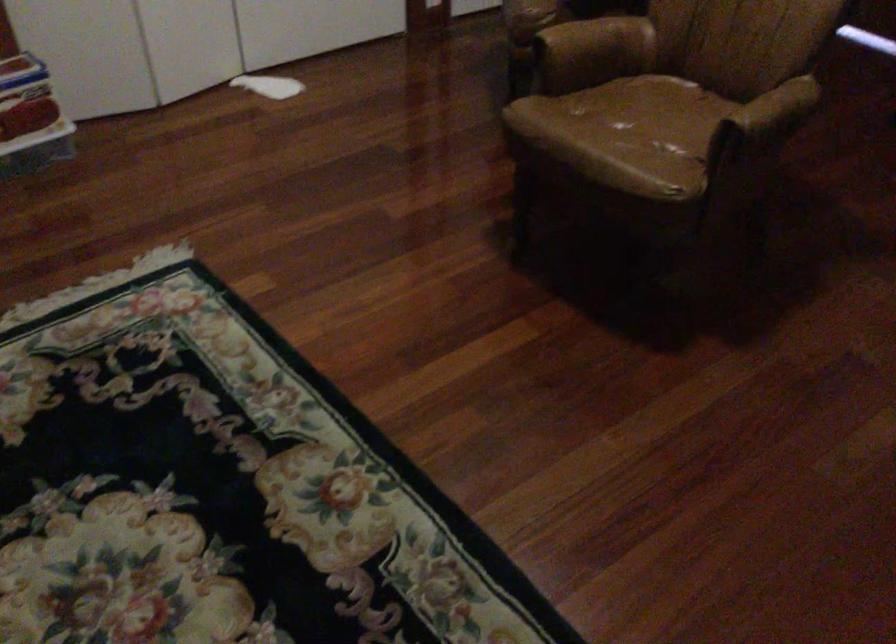
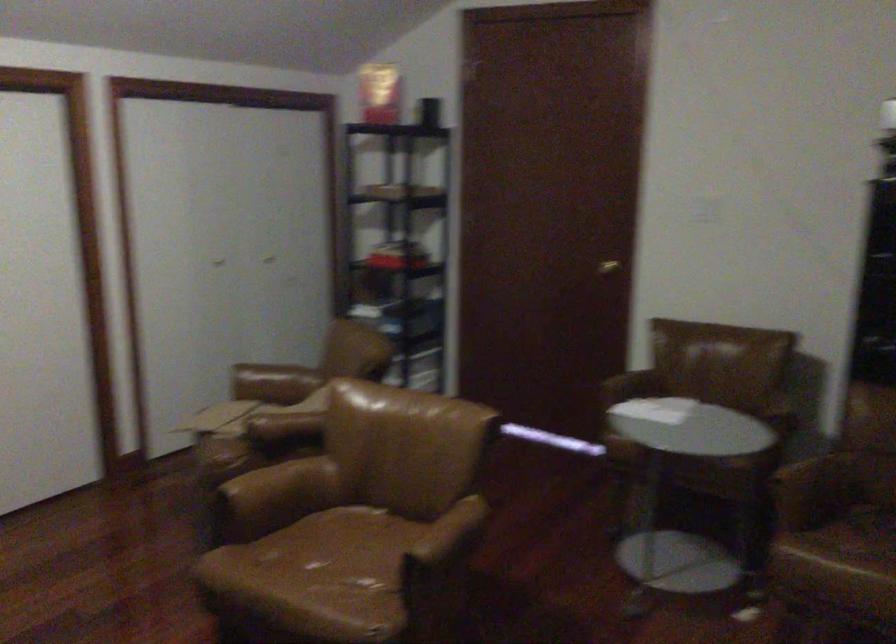
In the second image, find the point that corresponds to pixel 771 109 in the first image.

(448, 536)